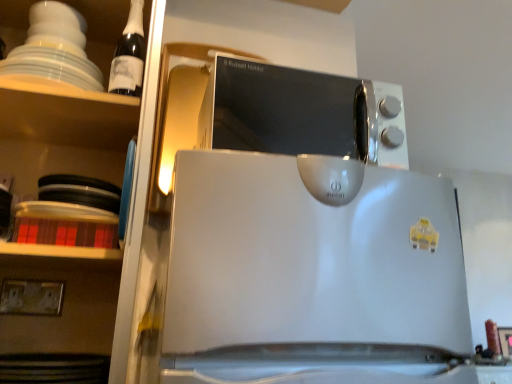
Question: From their relative heights in the image, would you say satin silver microwave at upper center is taller or shorter than white glossy shelves at upper left?

Choices:
 (A) tall
 (B) short

Answer: (B)

Question: Is satin silver microwave at upper center inside or outside of white glossy shelves at upper left?

Choices:
 (A) inside
 (B) outside

Answer: (B)

Question: Which is nearer to the satin silver microwave at upper center?

Choices:
 (A) dark glass bottle at upper left
 (B) white glossy shelves at upper left
 (C) white plastic electric outlet at lower left

Answer: (B)

Question: Based on their relative distances, which object is nearer to the white glossy shelves at upper left?

Choices:
 (A) white plastic electric outlet at lower left
 (B) dark glass bottle at upper left
 (C) satin silver microwave at upper center

Answer: (B)